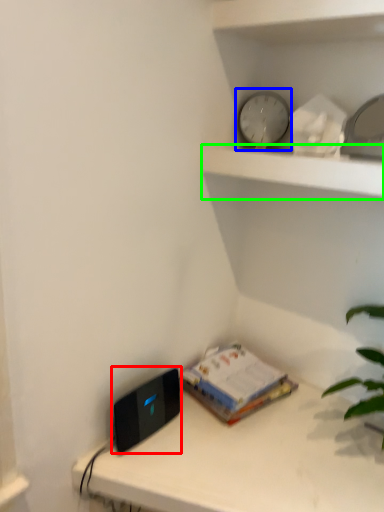
Question: Estimate the real-world distances between objects in this image. Which object is farther from ipod (highlighted by a red box), clock (highlighted by a blue box) or shelf (highlighted by a green box)?

Choices:
 (A) clock
 (B) shelf

Answer: (A)